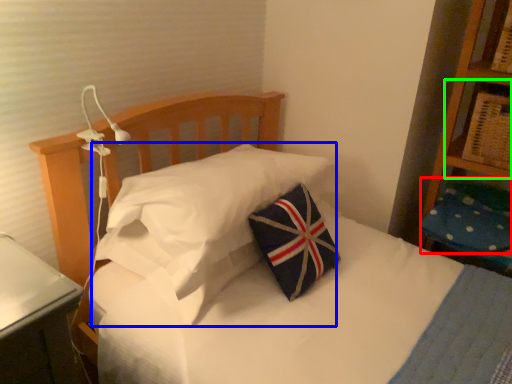
Question: Which object is positioned farthest from pillow (highlighted by a red box)? Select from pillow (highlighted by a blue box) and shelf (highlighted by a green box).

Choices:
 (A) pillow
 (B) shelf

Answer: (A)